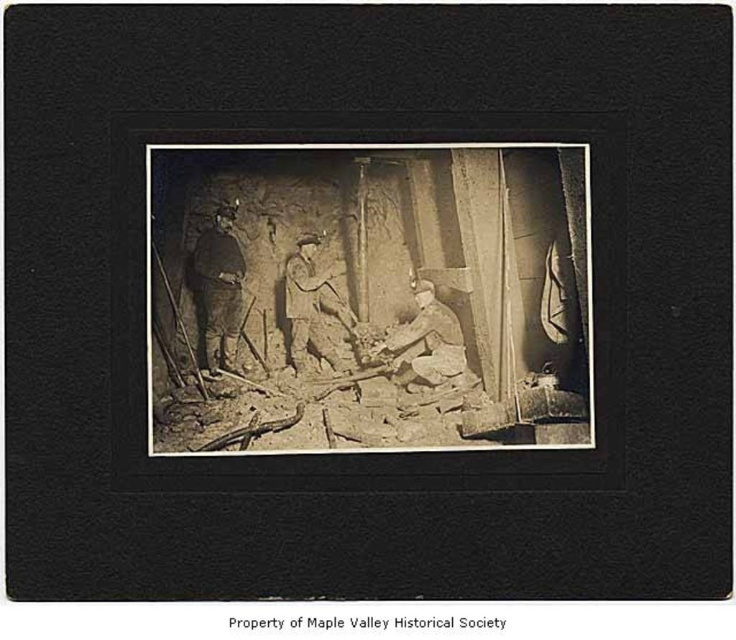
Measure the distance from dark brown leather jacket at center to light brown leather jacket at lower right.

dark brown leather jacket at center and light brown leather jacket at lower right are 17.52 inches apart.

Does dark brown leather jacket at center have a lesser height compared to light brown leather jacket at lower right?

No, dark brown leather jacket at center is not shorter than light brown leather jacket at lower right.

Describe the element at coordinates (216, 289) in the screenshot. This screenshot has width=736, height=640. I see `dark brown leather jacket at center` at that location.

This screenshot has height=640, width=736. Find the location of `dark brown leather jacket at center`. dark brown leather jacket at center is located at coordinates (216, 289).

Does point (417, 486) come behind point (208, 333)?

No, (417, 486) is in front of (208, 333).

In the scene shown: Is sepia-toned wood frame at center shorter than dark brown leather jacket at center?

No.

Measure the distance between point (422, 116) and camera.

Point (422, 116) is 2.49 meters from camera.

The image size is (736, 640). What are the coordinates of `sepia-toned wood frame at center` in the screenshot? It's located at (368, 300).

Does sepia-toned wood frame at center have a lesser width compared to light brown leather jacket at lower right?

Incorrect, sepia-toned wood frame at center's width is not less than light brown leather jacket at lower right's.

Does point (171, 323) come in front of point (403, 353)?

Yes, point (171, 323) is closer to viewer.

I want to click on sepia-toned wood frame at center, so [x=368, y=300].